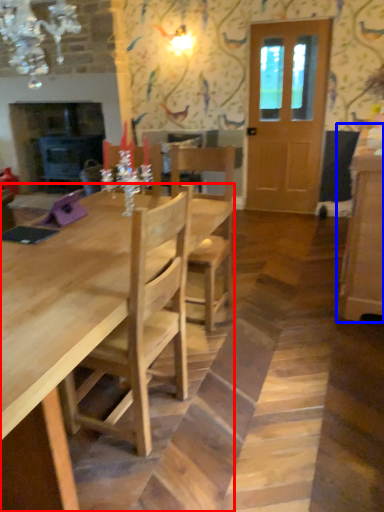
Question: Which point is closer to the camera, kitchen & dining room table (highlighted by a red box) or cabinetry (highlighted by a blue box)?

Choices:
 (A) kitchen & dining room table
 (B) cabinetry

Answer: (A)